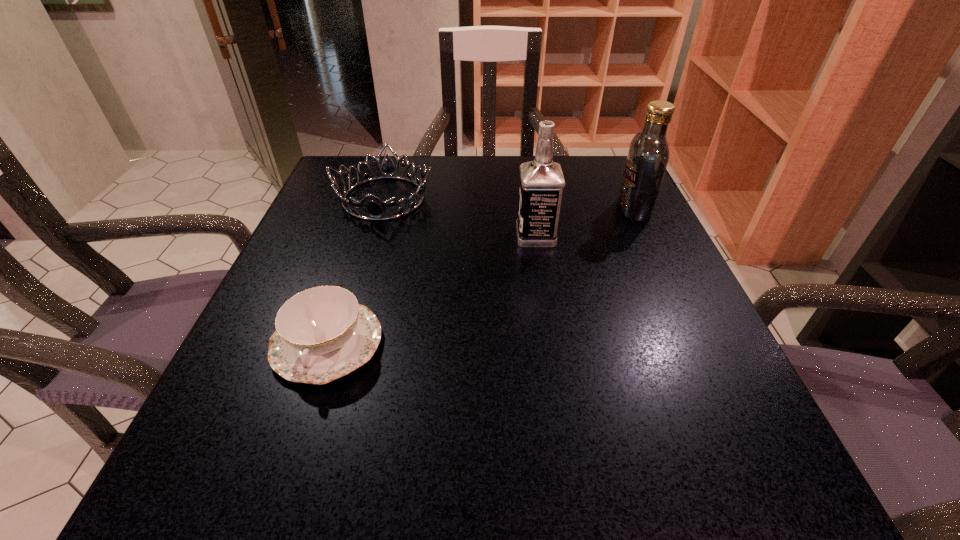
You are a GUI agent. You are given a task and a screenshot of the screen. Output one action in this format:
    pyautogui.click(x=<x>, y=<y>)
    Task: Click on the object situated at the far right corner
    
    Given the screenshot: What is the action you would take?
    pyautogui.click(x=648, y=156)

The width and height of the screenshot is (960, 540). In the image, there is a desktop. Identify the location of free space at the far edge. (451, 208).

Find the location of a particular element. The width and height of the screenshot is (960, 540). vacant area at the near edge of the desktop is located at coordinates (608, 463).

This screenshot has width=960, height=540. In the image, there is a desktop. In order to click on free space at the left edge in this screenshot , I will do `click(201, 436)`.

Locate an element on the screen. This screenshot has height=540, width=960. free region at the right edge is located at coordinates [588, 241].

In the image, there is a desktop. Where is `free space at the far left corner`? Image resolution: width=960 pixels, height=540 pixels. free space at the far left corner is located at coordinates (385, 197).

Find the location of `vacant space at the near left corner of the desktop`. vacant space at the near left corner of the desktop is located at coordinates [200, 515].

This screenshot has width=960, height=540. What are the coordinates of `free space at the near right corner` in the screenshot? It's located at (751, 469).

Identify the location of vacant space in between the nearest object and the second object from right to left. The width and height of the screenshot is (960, 540). (432, 289).

Where is `vacant point located between the third object from left to right and the chinaware`? This screenshot has height=540, width=960. vacant point located between the third object from left to right and the chinaware is located at coordinates (432, 289).